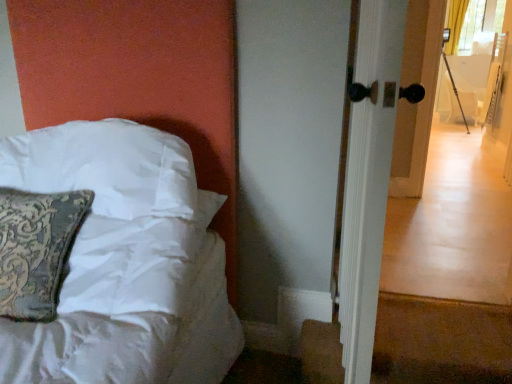
Question: Considering the positions of point (460, 82) and point (36, 162), is point (460, 82) closer or farther from the camera than point (36, 162)?

Choices:
 (A) closer
 (B) farther

Answer: (B)

Question: From a real-world perspective, is white fabric armchair at right physically located above or below white satin pillow at left?

Choices:
 (A) below
 (B) above

Answer: (A)

Question: Estimate the real-world distances between objects in this image. Which object is closer to the white fabric armchair at right?

Choices:
 (A) white glossy door handle at right
 (B) white satin pillow at left

Answer: (A)

Question: Which of these objects is positioned closest to the white glossy door handle at right?

Choices:
 (A) white fabric armchair at right
 (B) white satin pillow at left

Answer: (B)